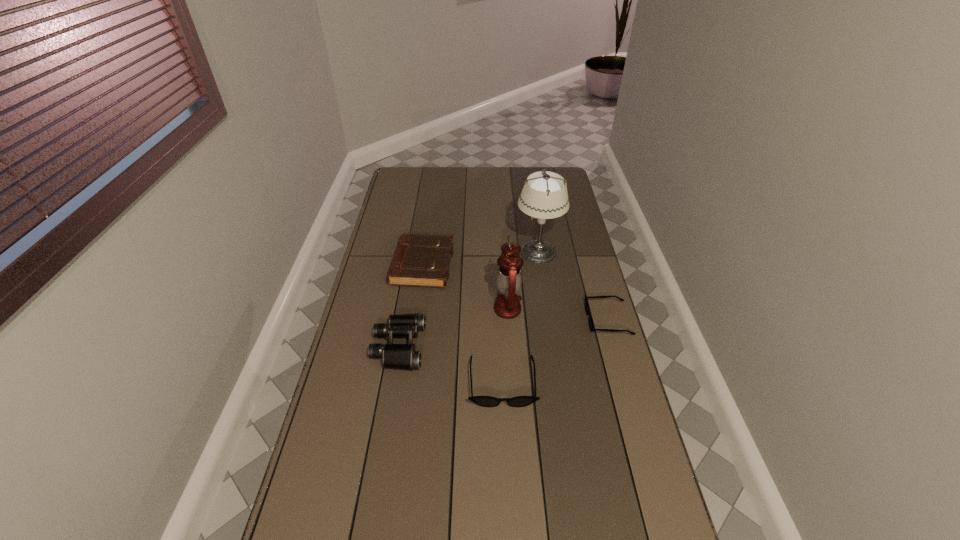
You are a GUI agent. You are given a task and a screenshot of the screen. Output one action in this format:
    pyautogui.click(x=<x>, y=<y>)
    Task: Click on the free space that is in between the binoculars and the fourth tallest object
    
    Given the screenshot: What is the action you would take?
    pyautogui.click(x=411, y=306)

Where is `free area in between the taller sunglasses and the binoculars`? This screenshot has height=540, width=960. free area in between the taller sunglasses and the binoculars is located at coordinates (450, 364).

What are the coordinates of `free spot between the nearer sunglasses and the oil lamp` in the screenshot? It's located at (505, 346).

The height and width of the screenshot is (540, 960). I want to click on free space between the nearer sunglasses and the right sunglasses, so click(x=555, y=351).

You are a GUI agent. You are given a task and a screenshot of the screen. Output one action in this format:
    pyautogui.click(x=<x>, y=<y>)
    Task: Click on the free space between the fourth shortest object and the left sunglasses
    The image size is (960, 540).
    Given the screenshot: What is the action you would take?
    pyautogui.click(x=450, y=364)

Identify the location of free space between the rightmost object and the binoculars. (503, 333).

You are a GUI agent. You are given a task and a screenshot of the screen. Output one action in this format:
    pyautogui.click(x=<x>, y=<y>)
    Task: Click on the object that stands as the closest to the lampshade
    The height and width of the screenshot is (540, 960).
    Given the screenshot: What is the action you would take?
    pyautogui.click(x=509, y=278)

At what (x,y) coordinates should I click in order to perform the action: click on object that is the second closest one to the lampshade. Please return your answer as a coordinate pair (x, y). The width and height of the screenshot is (960, 540). Looking at the image, I should click on [591, 325].

I want to click on vacant space that satisfies the following two spatial constraints: 1. on the lampshade of the lampshade; 2. on the front side of the oil lamp, so click(547, 309).

The height and width of the screenshot is (540, 960). I want to click on free space that satisfies the following two spatial constraints: 1. on the lampshade of the lampshade; 2. on the front side of the fourth tallest object, so click(x=540, y=266).